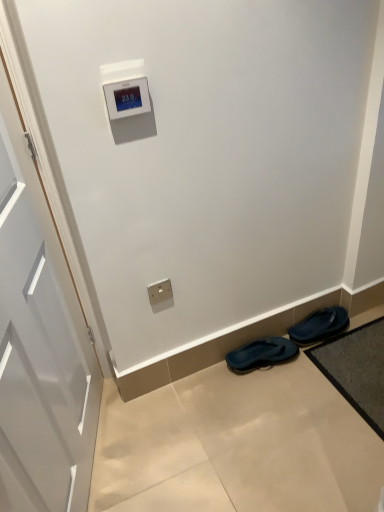
Identify the location of free space in front of black rubber slippers at lower right, placed as the 2th footwear when sorted from left to right. (329, 364).